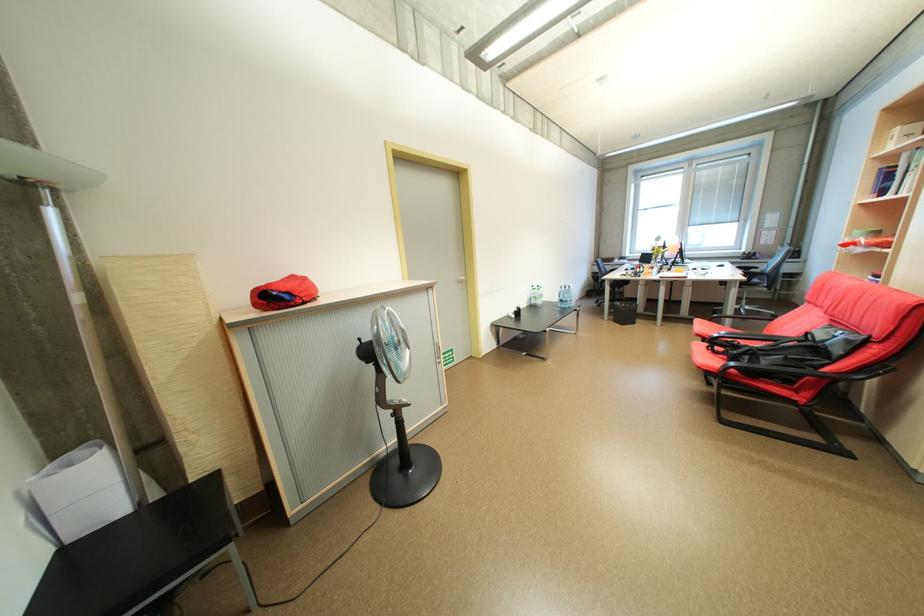
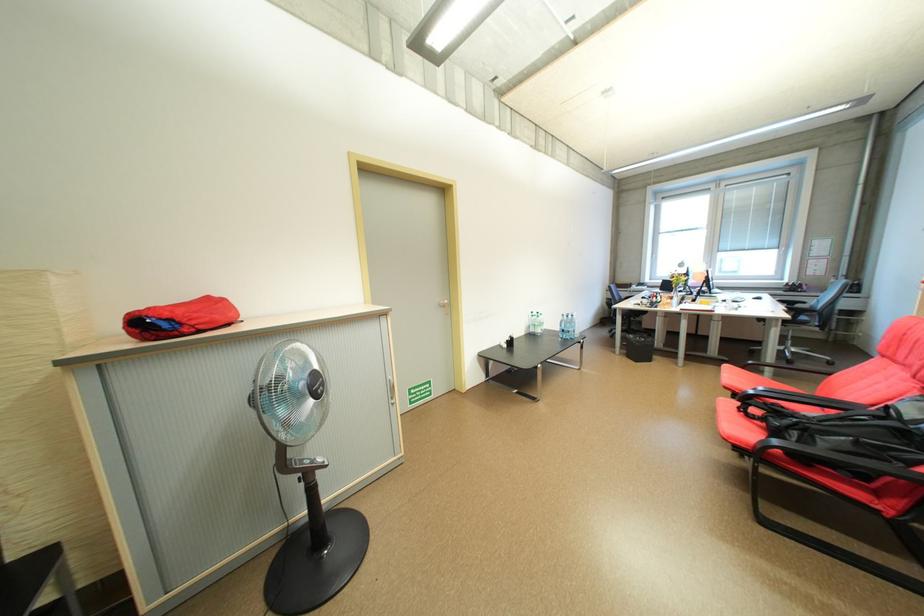
The point at (541, 302) is marked in the first image. Where is the corresponding point in the second image?

(541, 331)